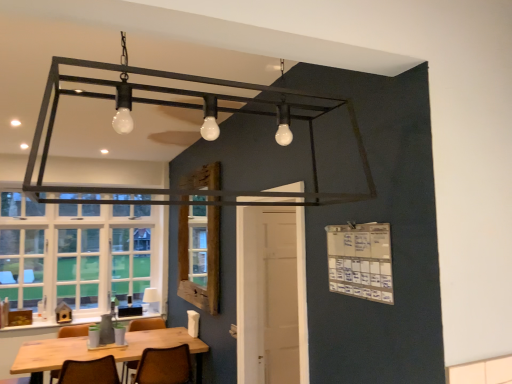
Identify the location of brown leather chair at lower center, arranged as the 2th chair when viewed from the left. (146, 324).

Locate an element on the screen. This screenshot has height=384, width=512. wooden table at lower left is located at coordinates (101, 351).

What do you see at coordinates (101, 351) in the screenshot? The height and width of the screenshot is (384, 512). I see `wooden table at lower left` at bounding box center [101, 351].

Measure the distance between wooden frame at center and camera.

The distance of wooden frame at center from camera is 9.84 feet.

Where is `white glass window at left`? This screenshot has width=512, height=384. white glass window at left is located at coordinates (77, 255).

Describe the element at coordinates (77, 255) in the screenshot. I see `white glass window at left` at that location.

What do you see at coordinates (74, 330) in the screenshot?
I see `brown leather chair at lower left, the first chair positioned from the left` at bounding box center [74, 330].

What are the coordinates of `brown leather chair at lower center, the second chair in the right-to-left sequence` in the screenshot? It's located at (146, 324).

Based on their sizes in the image, would you say brown leather chair at lower center, arranged as the 2th chair when viewed from the left, is bigger or smaller than white glass window at left?

In the image, brown leather chair at lower center, arranged as the 2th chair when viewed from the left, appears to be smaller than white glass window at left.

Which is behind, brown leather chair at lower center, arranged as the 2th chair when viewed from the left, or white glass window at left?

white glass window at left is behind.

Between brown leather chair at lower center, arranged as the 2th chair when viewed from the left, and white glass window at left, which one has more height?

white glass window at left.

Is white glass window at left oriented away from white fabric lampshade at lower center?

Correct, white glass window at left is looking away from white fabric lampshade at lower center.

From a real-world perspective, between white glass window at left and white fabric lampshade at lower center, who is vertically higher?

white glass window at left, from a real-world perspective.

Does point (15, 211) come closer to viewer compared to point (151, 290)?

Yes.

Considering the relative sizes of white glass window at left and white fabric lampshade at lower center in the image provided, is white glass window at left shorter than white fabric lampshade at lower center?

Incorrect, the height of white glass window at left does not fall short of that of white fabric lampshade at lower center.

From a real-world perspective, which is physically below, brown leather chair at lower left, the first chair positioned from the left, or white glass window at left?

In real-world perspective, brown leather chair at lower left, the first chair positioned from the left, is lower.

Could you tell me if brown leather chair at lower left, acting as the 3th chair starting from the right, is facing white glass window at left?

No, brown leather chair at lower left, acting as the 3th chair starting from the right, is not oriented towards white glass window at left.

From the image's perspective, which object appears higher, brown leather chair at lower left, the first chair positioned from the left, or white glass window at left?

From the image's view, white glass window at left is above.

Considering the relative sizes of brown leather chair at lower left, the first chair positioned from the left, and wooden table at lower left in the image provided, is brown leather chair at lower left, the first chair positioned from the left, bigger than wooden table at lower left?

Indeed, brown leather chair at lower left, the first chair positioned from the left, has a larger size compared to wooden table at lower left.

This screenshot has width=512, height=384. I want to click on the 1st chair counting from the right side of the wooden table at lower left, so click(74, 330).

From the image's perspective, relative to wooden table at lower left, is brown leather chair at lower left, acting as the 3th chair starting from the right, above or below?

brown leather chair at lower left, acting as the 3th chair starting from the right, is above wooden table at lower left.

Is brown leather chair at lower left, the first chair positioned from the left, positioned with its back to wooden table at lower left?

A: Absolutely, brown leather chair at lower left, the first chair positioned from the left, is directed away from wooden table at lower left.

Could you measure the distance between brown leather chair at lower center, arranged as the 2th chair when viewed from the left, and white fabric lampshade at lower center?

brown leather chair at lower center, arranged as the 2th chair when viewed from the left, and white fabric lampshade at lower center are 19.04 inches apart.

Considering the relative sizes of brown leather chair at lower center, arranged as the 2th chair when viewed from the left, and white fabric lampshade at lower center in the image provided, is brown leather chair at lower center, arranged as the 2th chair when viewed from the left, smaller than white fabric lampshade at lower center?

Incorrect, brown leather chair at lower center, arranged as the 2th chair when viewed from the left, is not smaller in size than white fabric lampshade at lower center.

Is brown leather chair at lower center, arranged as the 2th chair when viewed from the left, positioned far away from white fabric lampshade at lower center?

No, there isn't a large distance between brown leather chair at lower center, arranged as the 2th chair when viewed from the left, and white fabric lampshade at lower center.

Based on the photo, from a real-world perspective, is brown leather chair at lower center, the second chair in the right-to-left sequence, over white fabric lampshade at lower center?

No, from a real-world perspective, brown leather chair at lower center, the second chair in the right-to-left sequence, is not on top of white fabric lampshade at lower center.

Where is `window screen above the wooden table at lower left (from a real-world perspective)`? This screenshot has width=512, height=384. window screen above the wooden table at lower left (from a real-world perspective) is located at coordinates (199, 256).

Looking at the image, does wooden frame at center seem bigger or smaller compared to wooden table at lower left?

In the image, wooden frame at center appears to be larger than wooden table at lower left.

Would you say wooden frame at center is to the left or to the right of wooden table at lower left in the picture?

In the image, wooden frame at center appears on the right side of wooden table at lower left.

Which of these two, wooden frame at center or wooden table at lower left, stands shorter?

Standing shorter between the two is wooden table at lower left.

Based on the photo, from a real-world perspective, which is physically above, brown leather chair at lower center, the third chair viewed from the left, or brown leather chair at lower left, acting as the 3th chair starting from the right?

brown leather chair at lower left, acting as the 3th chair starting from the right.

Is brown leather chair at lower center, the third chair viewed from the left, further to camera compared to brown leather chair at lower left, the first chair positioned from the left?

That is False.

Is brown leather chair at lower center, which is counted as the first chair, starting from the right, positioned far away from brown leather chair at lower left, the first chair positioned from the left?

That's not correct — brown leather chair at lower center, which is counted as the first chair, starting from the right, is a little close to brown leather chair at lower left, the first chair positioned from the left.

Is brown leather chair at lower center, the third chair viewed from the left, bigger or smaller than brown leather chair at lower left, the first chair positioned from the left?

brown leather chair at lower center, the third chair viewed from the left, is bigger than brown leather chair at lower left, the first chair positioned from the left.

This screenshot has width=512, height=384. In order to click on window to the left of brown leather chair at lower center, arranged as the 2th chair when viewed from the left in this screenshot , I will do `click(77, 255)`.

Find the location of a particular element. The height and width of the screenshot is (384, 512). window above the white fabric lampshade at lower center (from a real-world perspective) is located at coordinates (77, 255).

Estimate the real-world distances between objects in this image. Which object is further from white fabric lampshade at lower center, wooden table at lower left or wooden table at lower left?

wooden table at lower left.

Considering their positions, is white fabric lampshade at lower center positioned closer to wooden table at lower left than brown leather chair at lower center, the third chair viewed from the left?

Among the two, brown leather chair at lower center, the third chair viewed from the left, is located nearer to wooden table at lower left.

When comparing their distances from brown leather chair at lower center, arranged as the 2th chair when viewed from the left, does wooden table at lower left or white fabric lampshade at lower center seem closer?

white fabric lampshade at lower center is positioned closer to the anchor brown leather chair at lower center, arranged as the 2th chair when viewed from the left.

When comparing their distances from wooden table at lower left, does brown leather chair at lower left, the first chair positioned from the left, or brown leather chair at lower center, which is counted as the first chair, starting from the right, seem closer?

brown leather chair at lower left, the first chair positioned from the left, lies closer to wooden table at lower left than the other object.

Considering their positions, is wooden table at lower left positioned closer to wooden frame at center than brown leather chair at lower center, arranged as the 2th chair when viewed from the left?

wooden table at lower left is positioned closer to the anchor wooden frame at center.

Based on the photo, when comparing their distances from brown leather chair at lower left, acting as the 3th chair starting from the right, does wooden table at lower left or brown leather chair at lower center, arranged as the 2th chair when viewed from the left, seem further?

brown leather chair at lower center, arranged as the 2th chair when viewed from the left, is further to brown leather chair at lower left, acting as the 3th chair starting from the right.

When comparing their distances from wooden frame at center, does white glass window at left or brown leather chair at lower center, arranged as the 2th chair when viewed from the left, seem closer?

brown leather chair at lower center, arranged as the 2th chair when viewed from the left.

Based on the photo, from the image, which object appears to be nearer to brown leather chair at lower left, the first chair positioned from the left, brown leather chair at lower center, which is counted as the first chair, starting from the right, or white fabric lampshade at lower center?

brown leather chair at lower center, which is counted as the first chair, starting from the right, is closer to brown leather chair at lower left, the first chair positioned from the left.

I want to click on counter top between brown leather chair at lower center, the third chair viewed from the left, and white fabric lampshade at lower center in the front-back direction, so click(30, 331).

Find the location of a particular element. counter top between white glass window at left and white fabric lampshade at lower center in the horizontal direction is located at coordinates (30, 331).

Find the location of `window screen between wooden table at lower left and wooden table at lower left along the z-axis`. window screen between wooden table at lower left and wooden table at lower left along the z-axis is located at coordinates (199, 256).

At what (x,y) coordinates should I click in order to perform the action: click on window positioned between wooden frame at center and white fabric lampshade at lower center from near to far. Please return your answer as a coordinate pair (x, y). Looking at the image, I should click on (77, 255).